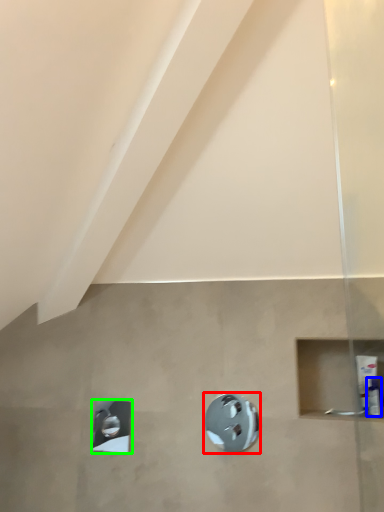
Question: Considering the real-world distances, which object is closest to shower (highlighted by a red box)? toiletry (highlighted by a blue box) or shower (highlighted by a green box).

Choices:
 (A) toiletry
 (B) shower

Answer: (B)